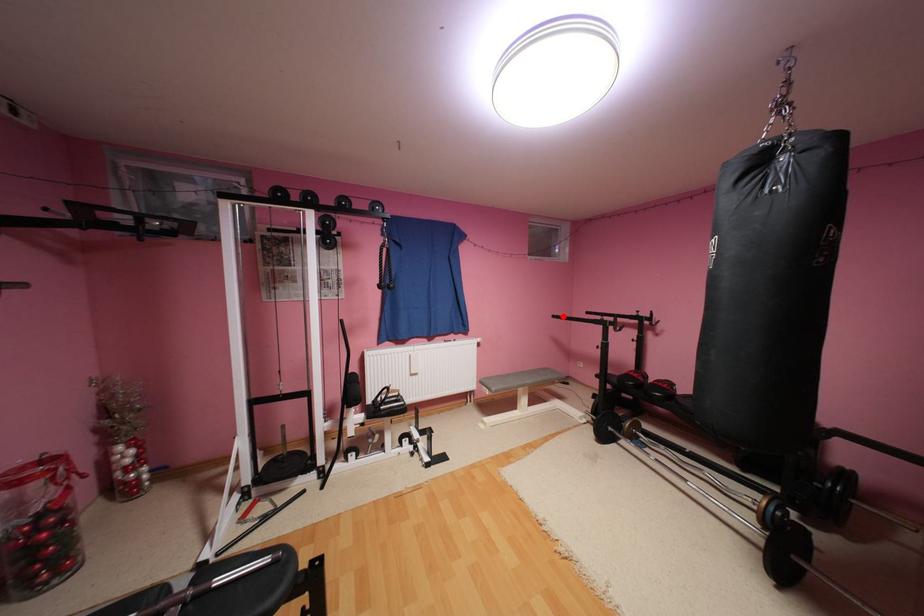
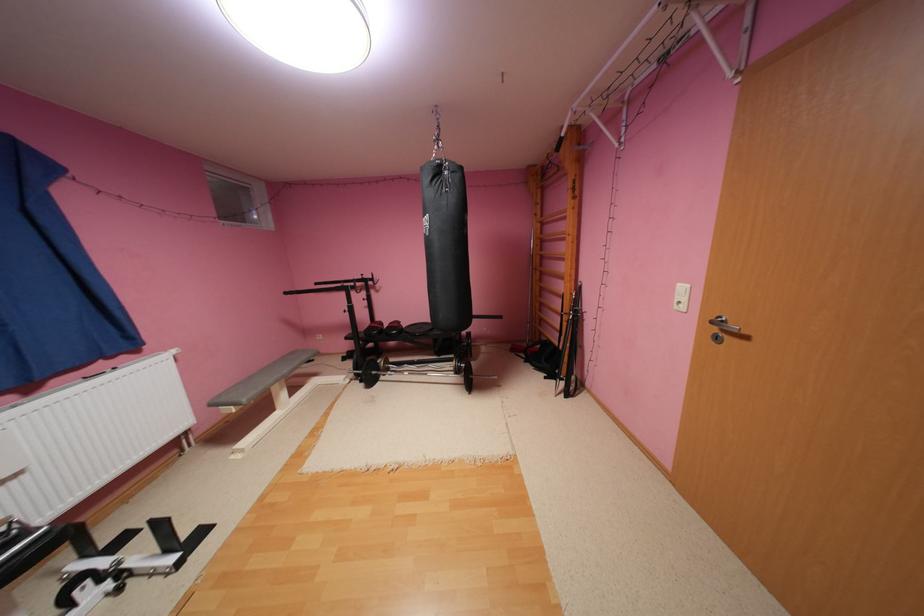
Question: I am providing you with two images of the same scene from different viewpoints. A red point is shown in image1. For the corresponding object point in image2, is it positioned nearer or farther from the camera?

Choices:
 (A) Nearer
 (B) Farther

Answer: (A)